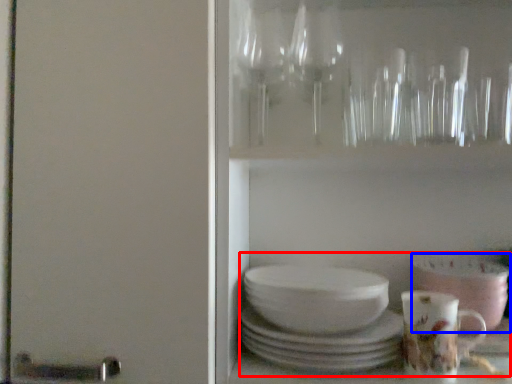
Question: Which object appears farthest to the camera in this image, tea set (highlighted by a red box) or bowl (highlighted by a blue box)?

Choices:
 (A) tea set
 (B) bowl

Answer: (B)